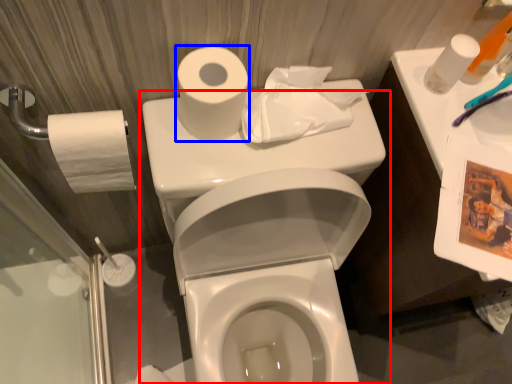
Question: Among these objects, which one is nearest to the camera, toilet (highlighted by a red box) or toilet paper (highlighted by a blue box)?

Choices:
 (A) toilet
 (B) toilet paper

Answer: (A)